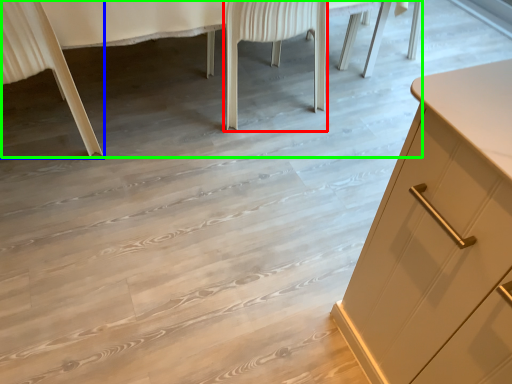
Question: Which is farther away from chair (highlighted by a red box)? chair (highlighted by a blue box) or vanity (highlighted by a green box)?

Choices:
 (A) chair
 (B) vanity

Answer: (A)